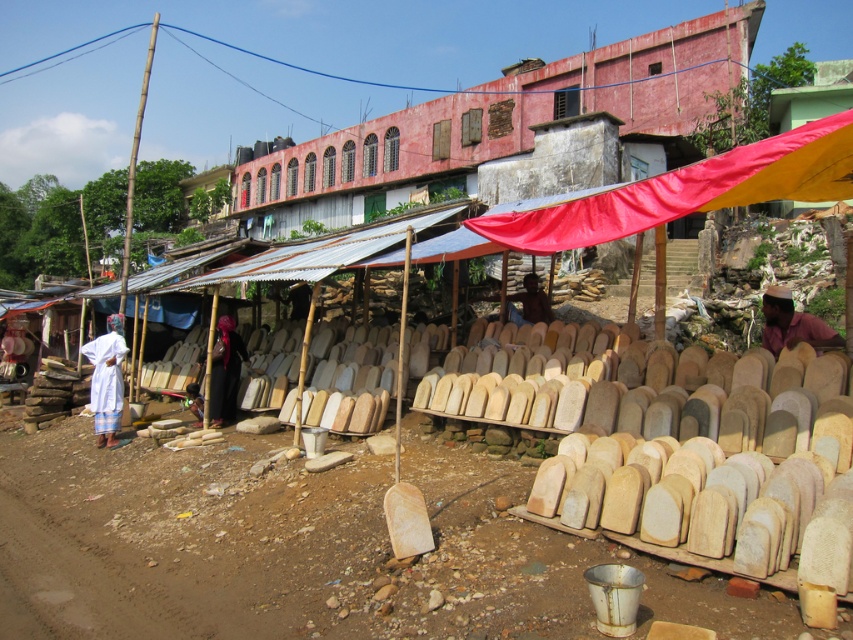
Is point (809, 316) behind point (216, 365)?

No, it is in front of (216, 365).

In the scene shown: Is brown fabric at right closer to the viewer compared to black fabric at center?

Yes, it is in front of black fabric at center.

Does point (764, 292) lie behind point (236, 332)?

Yes, point (764, 292) is behind point (236, 332).

Where is `brown fabric at right`? brown fabric at right is located at coordinates point(792,324).

Does white cloth at left appear on the left side of black fabric at center?

Yes, white cloth at left is to the left of black fabric at center.

Is point (119, 365) closer to camera compared to point (216, 403)?

Yes.

Where is `white cloth at left`? The image size is (853, 640). white cloth at left is located at coordinates (107, 380).

Find the location of a particular element. This screenshot has height=640, width=853. white cloth at left is located at coordinates (107, 380).

Identify the location of red fabric canopy at center. The image size is (853, 640). (691, 189).

Can you confirm if red fabric canopy at center is positioned above white cloth at left?

Yes, red fabric canopy at center is above white cloth at left.

Between point (776, 188) and point (105, 401), which one is positioned in front?

Point (776, 188) is in front.

Where is `red fabric canopy at center`? The image size is (853, 640). red fabric canopy at center is located at coordinates (691, 189).